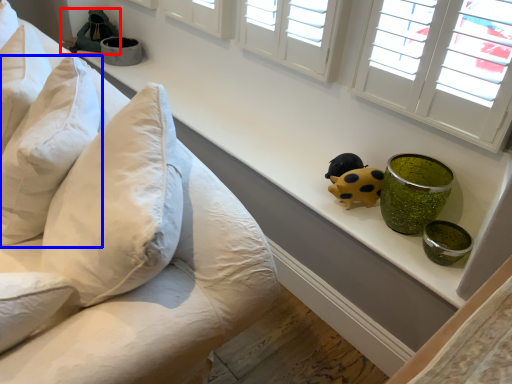
Question: Which of the following is the farthest to the observer, toy (highlighted by a red box) or pillow (highlighted by a blue box)?

Choices:
 (A) toy
 (B) pillow

Answer: (A)